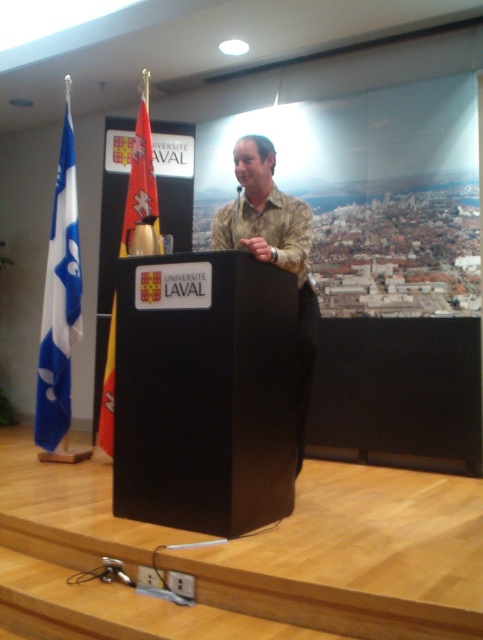
Question: Which object appears closest to the camera in this image?

Choices:
 (A) blue fabric flag at left
 (B) camouflage shirt at center
 (C) red fabric flag at left

Answer: (B)

Question: Which object is positioned farthest from the camouflage shirt at center?

Choices:
 (A) blue fabric flag at left
 (B) red fabric flag at left

Answer: (A)

Question: Does camouflage shirt at center appear over blue fabric flag at left?

Choices:
 (A) yes
 (B) no

Answer: (B)

Question: Estimate the real-world distances between objects in this image. Which object is farther from the blue fabric flag at left?

Choices:
 (A) camouflage shirt at center
 (B) red fabric flag at left

Answer: (A)

Question: Does camouflage shirt at center have a smaller size compared to blue fabric flag at left?

Choices:
 (A) yes
 (B) no

Answer: (B)

Question: From the image, what is the correct spatial relationship of blue fabric flag at left in relation to red fabric flag at left?

Choices:
 (A) left
 (B) right

Answer: (A)